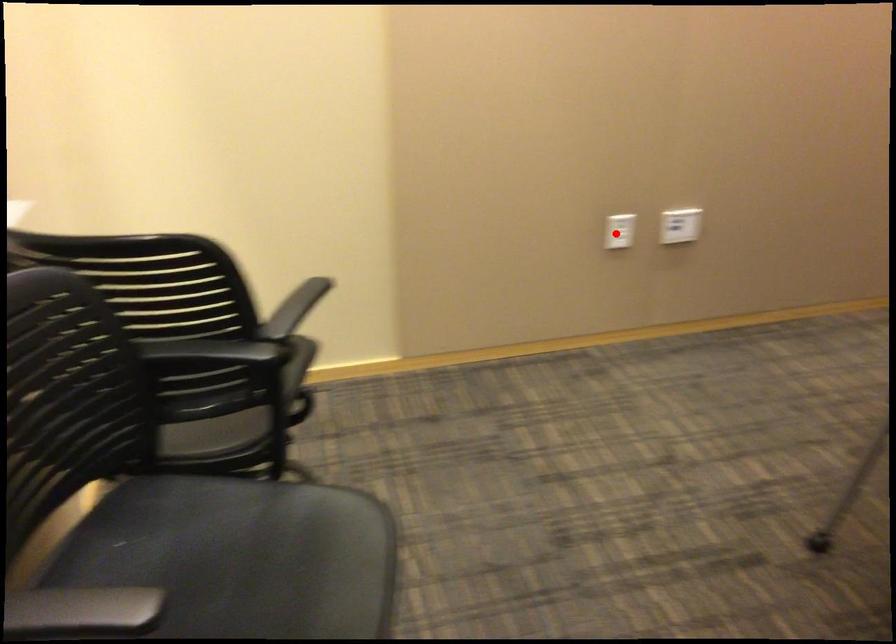
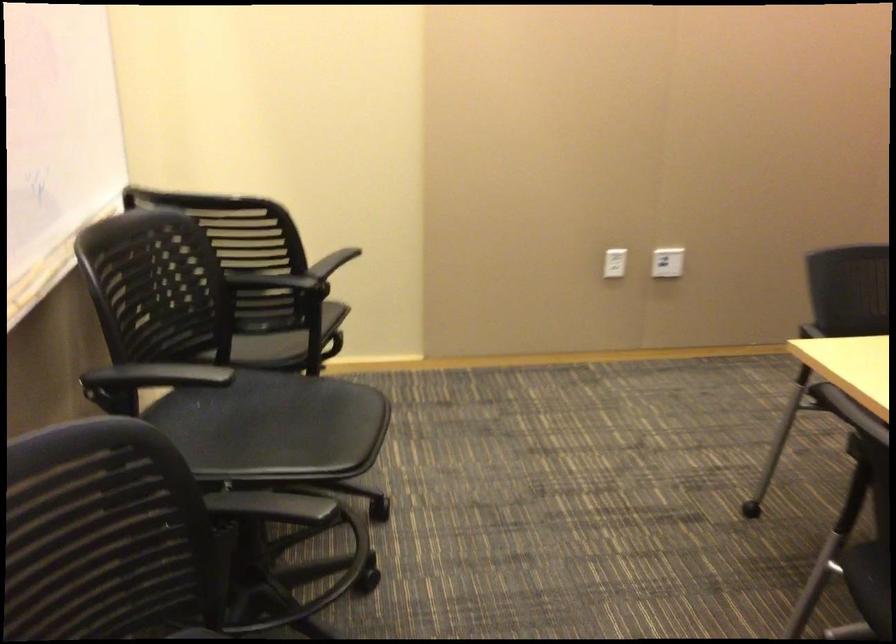
Question: I am providing you with two images of the same scene from different viewpoints. In image1, a red point is highlighted. Considering the same 3D point in image2, which of the following is correct?

Choices:
 (A) It is closer
 (B) It is farther

Answer: (B)